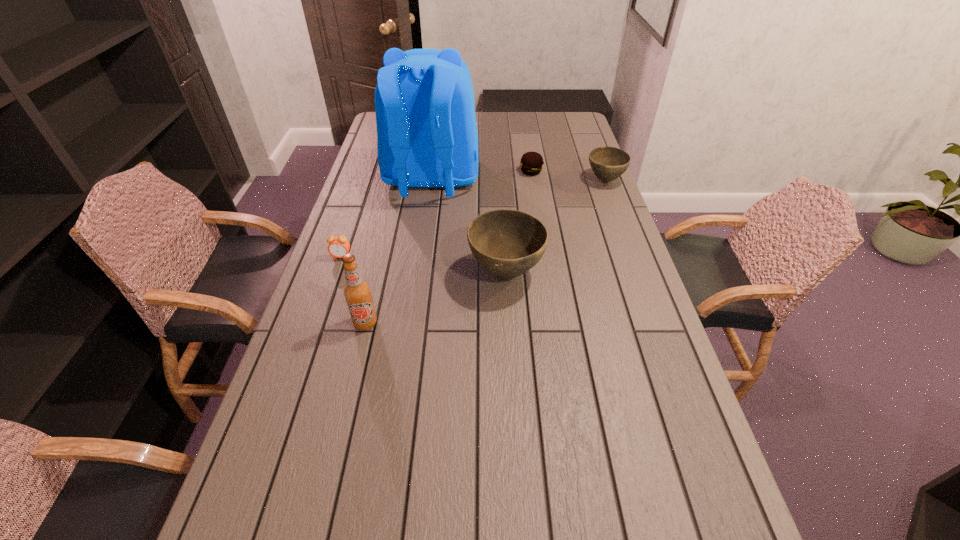
Where is `blank space located 0.300m on the back of the shorter bowl`? This screenshot has height=540, width=960. blank space located 0.300m on the back of the shorter bowl is located at coordinates (588, 134).

Identify the location of free region located 0.110m on the back of the backpack. The image size is (960, 540). (424, 231).

Locate an element on the screen. The height and width of the screenshot is (540, 960). free space located on the back of the shortest object is located at coordinates (525, 132).

Identify the location of vacant space situated 0.160m on the front label of the nearest object. This screenshot has width=960, height=540. (350, 387).

You are a GUI agent. You are given a task and a screenshot of the screen. Output one action in this format:
    pyautogui.click(x=<x>, y=<y>)
    Task: Click on the vacant space situated 0.210m on the face of the leftmost object
    The height and width of the screenshot is (540, 960).
    Given the screenshot: What is the action you would take?
    pyautogui.click(x=323, y=312)

The image size is (960, 540). In order to click on backpack that is at the left edge in this screenshot , I will do `click(427, 137)`.

Where is `beer bottle located in the left edge section of the desktop`? This screenshot has height=540, width=960. beer bottle located in the left edge section of the desktop is located at coordinates (357, 292).

Identify the location of alarm clock that is at the left edge. (338, 246).

What are the coordinates of `object at the right edge` in the screenshot? It's located at (608, 163).

This screenshot has height=540, width=960. I want to click on vacant area at the far edge of the desktop, so click(526, 116).